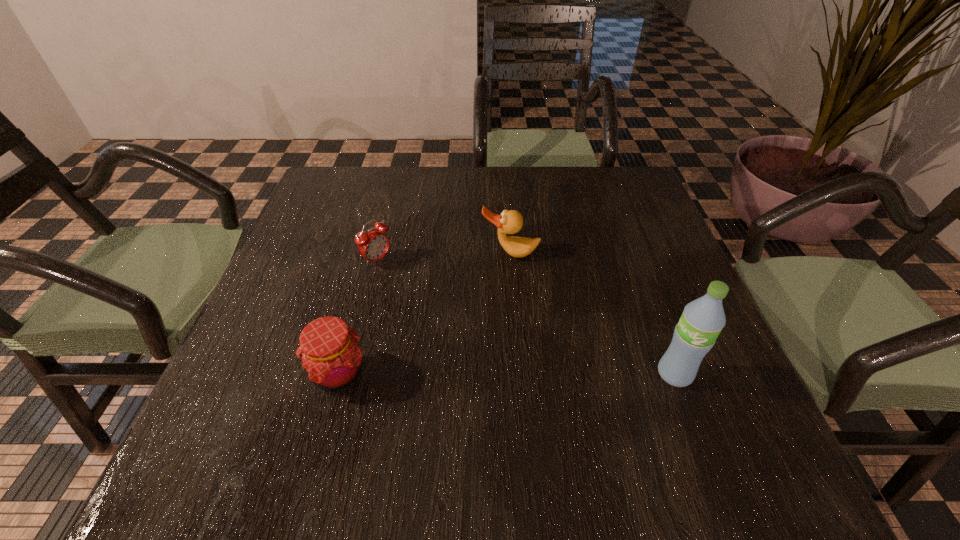
Identify the location of vacant space at the near edge of the desktop. (533, 399).

You are a GUI agent. You are given a task and a screenshot of the screen. Output one action in this format:
    pyautogui.click(x=<x>, y=<y>)
    Task: Click on the free location at the left edge
    This screenshot has height=540, width=960.
    Given the screenshot: What is the action you would take?
    pyautogui.click(x=285, y=284)

You are a GUI agent. You are given a task and a screenshot of the screen. Output one action in this format:
    pyautogui.click(x=<x>, y=<y>)
    Task: Click on the free space at the right edge of the desktop
    The image size is (960, 540).
    Given the screenshot: What is the action you would take?
    pyautogui.click(x=688, y=275)

In the image, there is a desktop. Where is `vacant space at the near left corner`? The height and width of the screenshot is (540, 960). vacant space at the near left corner is located at coordinates (220, 403).

Image resolution: width=960 pixels, height=540 pixels. Find the location of `vacant area at the far right corner`. vacant area at the far right corner is located at coordinates (615, 190).

Locate an element on the screen. This screenshot has width=960, height=540. free space between the duck and the alarm clock is located at coordinates (444, 257).

Where is `vacant space that is in between the jam and the third object from left to right`? The height and width of the screenshot is (540, 960). vacant space that is in between the jam and the third object from left to right is located at coordinates (424, 313).

The width and height of the screenshot is (960, 540). Identify the location of free area in between the water bottle and the alarm clock. 526,317.

The image size is (960, 540). Find the location of `free spot between the rightmost object and the second object from right to left`. free spot between the rightmost object and the second object from right to left is located at coordinates (592, 314).

Locate an element on the screen. free space between the jam and the rightmost object is located at coordinates (507, 373).